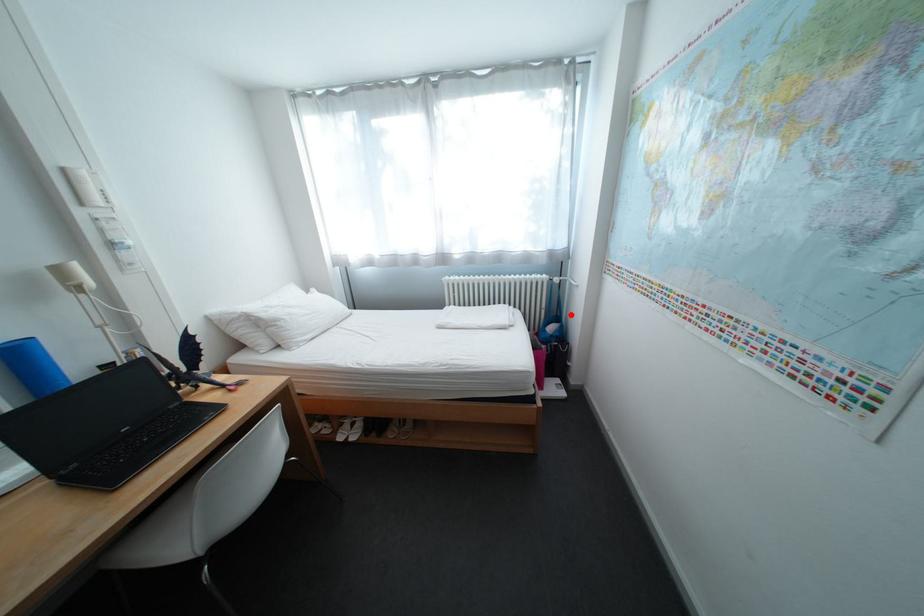
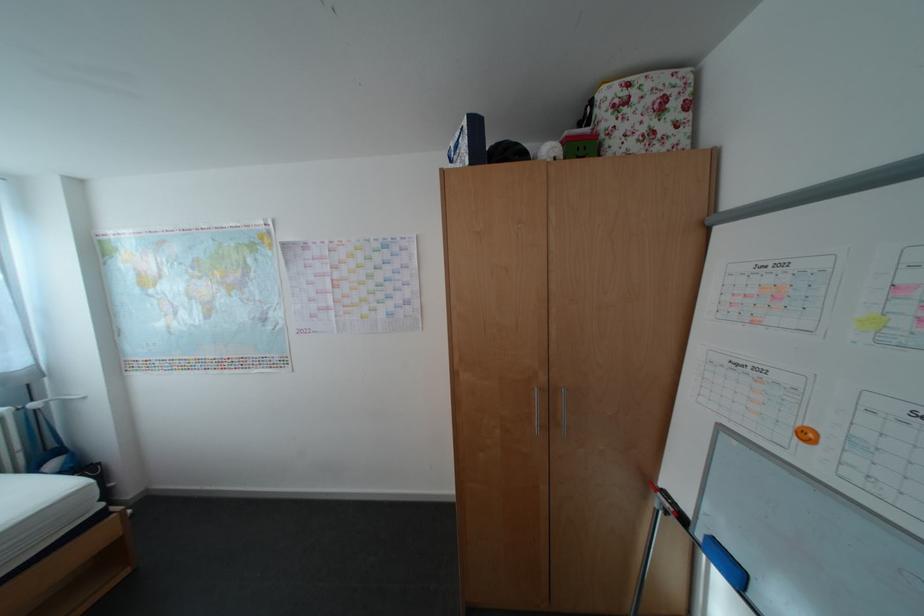
Question: I am providing you with two images of the same scene from different viewpoints. Image1 has a red point marked. In image2, the corresponding 3D location appears at what relative position? Reply with the corresponding letter.

Choices:
 (A) Closer
 (B) Farther

Answer: (B)